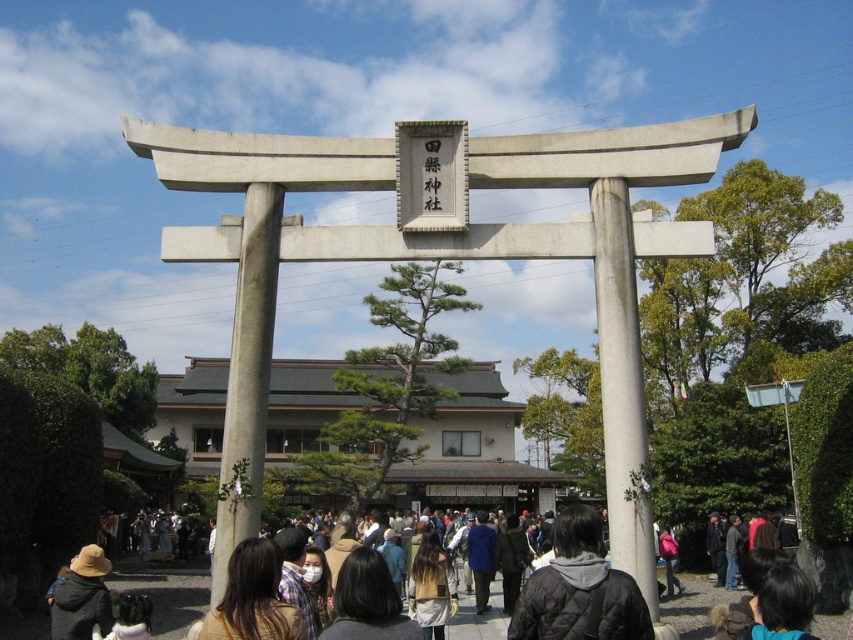
How distant is black quilted jacket at center from black hair at lower center?

black quilted jacket at center is 19.10 feet from black hair at lower center.

Who is more forward, (x=590, y=588) or (x=755, y=625)?

Positioned in front is point (x=590, y=588).

Which is behind, point (590, 548) or point (779, 582)?

The point (590, 548) is behind.

Find the location of a particular element. The height and width of the screenshot is (640, 853). black quilted jacket at center is located at coordinates (579, 589).

Between matte brown hat at lower left and black hair at lower center, which one is positioned higher?

Positioned higher is black hair at lower center.

Does matte brown hat at lower left have a greater width compared to black hair at lower center?

Yes.

You are a GUI agent. You are given a task and a screenshot of the screen. Output one action in this format:
    pyautogui.click(x=<x>, y=<y>)
    Task: Click on the matte brown hat at lower left
    The width and height of the screenshot is (853, 640).
    Given the screenshot: What is the action you would take?
    pyautogui.click(x=80, y=596)

Looking at this image, can you confirm if light brown hair at center is positioned to the left of pink fabric backpack at center?

Yes, light brown hair at center is to the left of pink fabric backpack at center.

Who is positioned more to the left, light brown hair at center or pink fabric backpack at center?

light brown hair at center

Is point (434, 560) farther from viewer compared to point (670, 552)?

No, it is in front of (670, 552).

Identify the location of light brown hair at center. The height and width of the screenshot is (640, 853). [430, 586].